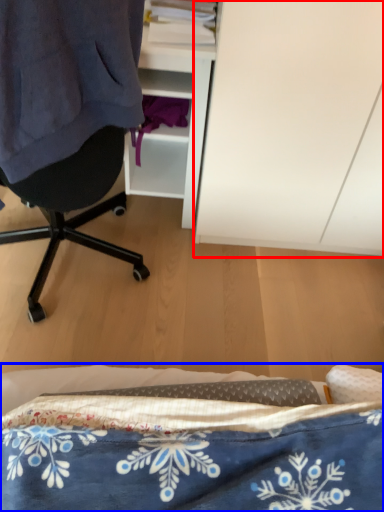
Question: Which object is closer to the camera taking this photo, cabinetry (highlighted by a red box) or bed (highlighted by a blue box)?

Choices:
 (A) cabinetry
 (B) bed

Answer: (B)